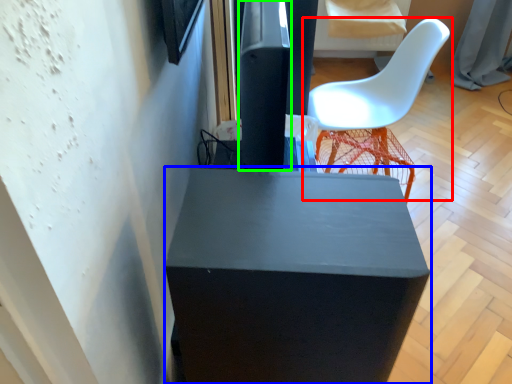
Question: Estimate the real-world distances between objects in this image. Which object is farther from chair (highlighted by a red box), furniture (highlighted by a blue box) or pillar (highlighted by a green box)?

Choices:
 (A) furniture
 (B) pillar

Answer: (A)